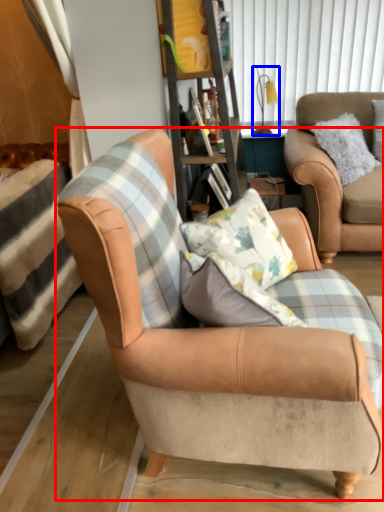
Question: Which point is closer to the camera, chair (highlighted by a red box) or lamp (highlighted by a blue box)?

Choices:
 (A) chair
 (B) lamp

Answer: (A)